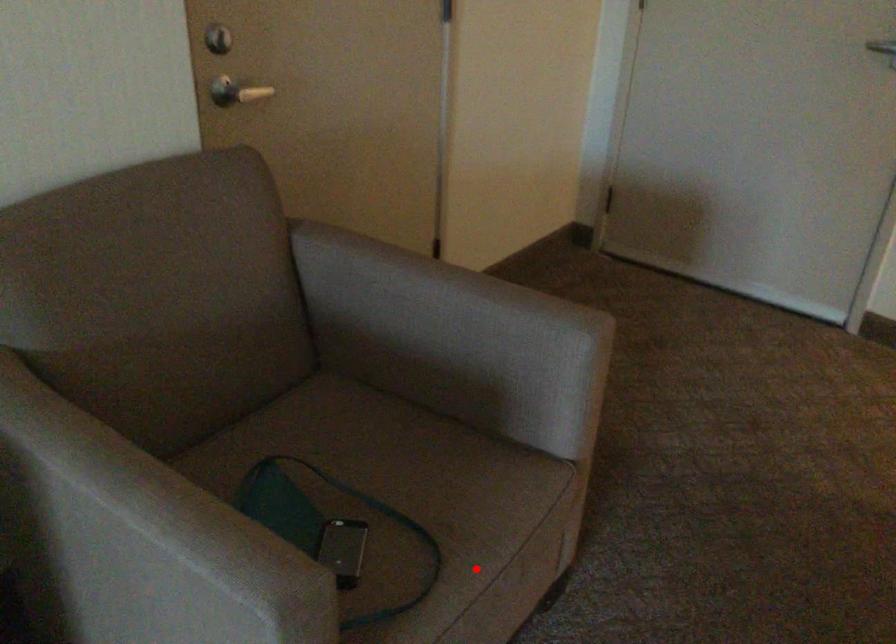
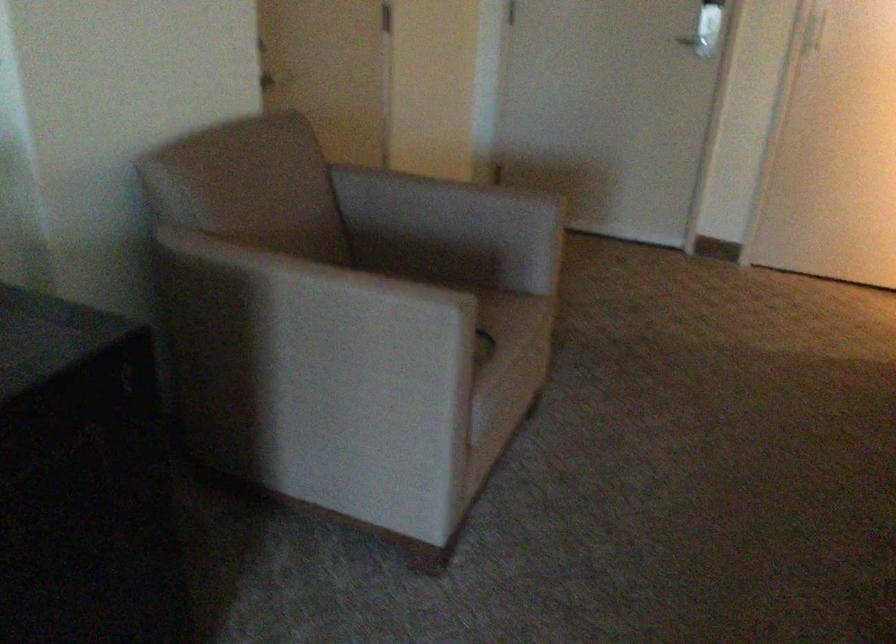
Question: I am providing you with two images of the same scene from different viewpoints. Image1 has a red point marked. In image2, the corresponding 3D location appears at what relative position? Reply with the corresponding letter.

Choices:
 (A) Closer
 (B) Farther

Answer: (B)